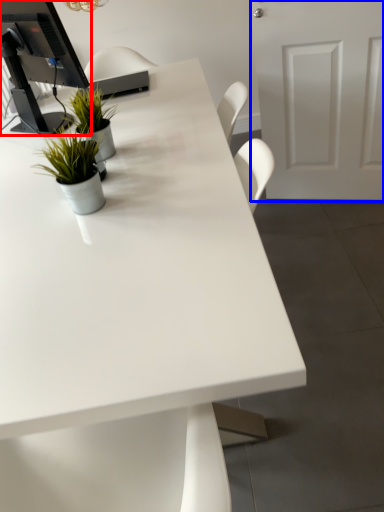
Question: Among these objects, which one is farthest to the camera, desktop computer (highlighted by a red box) or door (highlighted by a blue box)?

Choices:
 (A) desktop computer
 (B) door

Answer: (B)